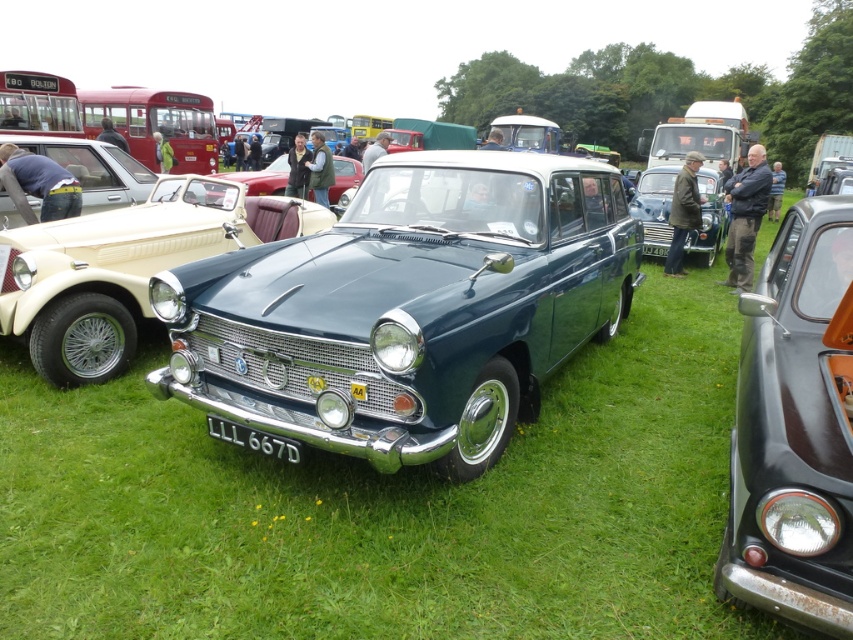
Question: Considering the relative positions of shiny blue car at center and metallic blue sedan at center in the image provided, where is shiny blue car at center located with respect to metallic blue sedan at center?

Choices:
 (A) right
 (B) left

Answer: (B)

Question: Observing the image, what is the correct spatial positioning of shiny black car at right in reference to black plastic license plate at center?

Choices:
 (A) right
 (B) left

Answer: (B)

Question: Which object appears closest to the camera in this image?

Choices:
 (A) metallic blue sedan at center
 (B) metallic red car at center
 (C) shiny black car at right
 (D) black plastic license plate at center

Answer: (C)

Question: Considering the relative positions of shiny blue car at center and metallic blue sedan at center in the image provided, where is shiny blue car at center located with respect to metallic blue sedan at center?

Choices:
 (A) right
 (B) left

Answer: (B)

Question: Which point is closer to the camera taking this photo?

Choices:
 (A) (258, 438)
 (B) (271, 186)

Answer: (A)

Question: Which point is farther to the camera?

Choices:
 (A) (61, 320)
 (B) (648, 253)
 (C) (706, 179)
 (D) (761, 512)

Answer: (C)